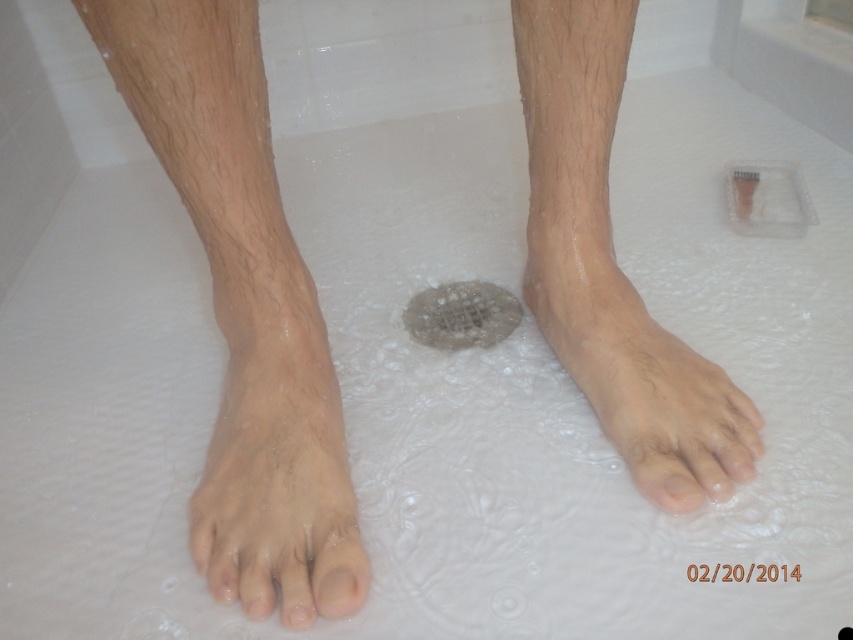
Question: Does dry skin at lower left have a larger size compared to dry skin at center?

Choices:
 (A) yes
 (B) no

Answer: (B)

Question: Which of the following is the closest to the observer?

Choices:
 (A) dry skin at left
 (B) dry skin at lower left

Answer: (A)

Question: Is dry skin at left positioned at the back of satin silver drain at center?

Choices:
 (A) yes
 (B) no

Answer: (B)

Question: Which object appears farthest from the camera in this image?

Choices:
 (A) dry skin at lower left
 (B) dry skin at center
 (C) satin silver drain at center
 (D) dry skin at lower center

Answer: (C)

Question: Is dry skin at lower left above satin silver drain at center?

Choices:
 (A) yes
 (B) no

Answer: (B)

Question: Which of the following is the farthest from the observer?

Choices:
 (A) dry skin at left
 (B) satin silver drain at center

Answer: (B)